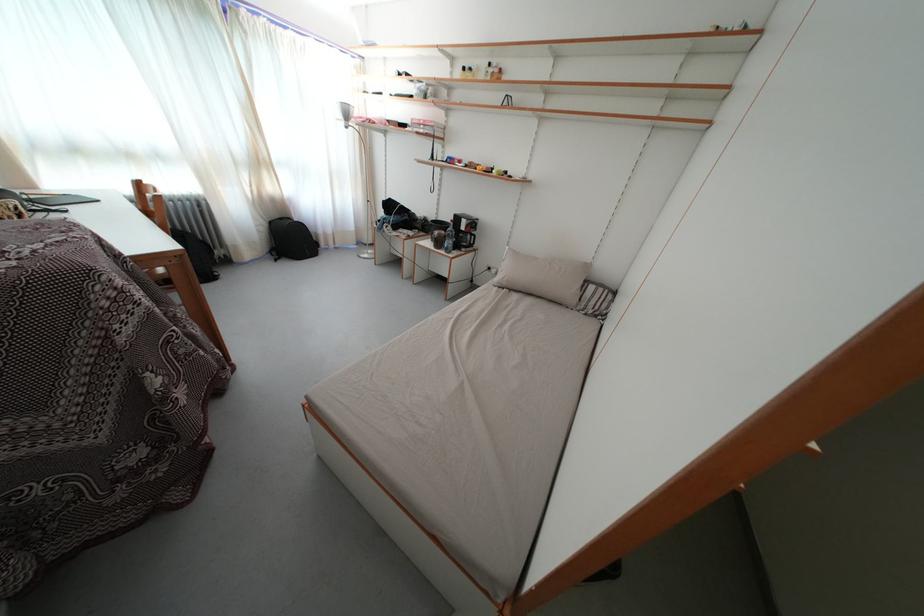
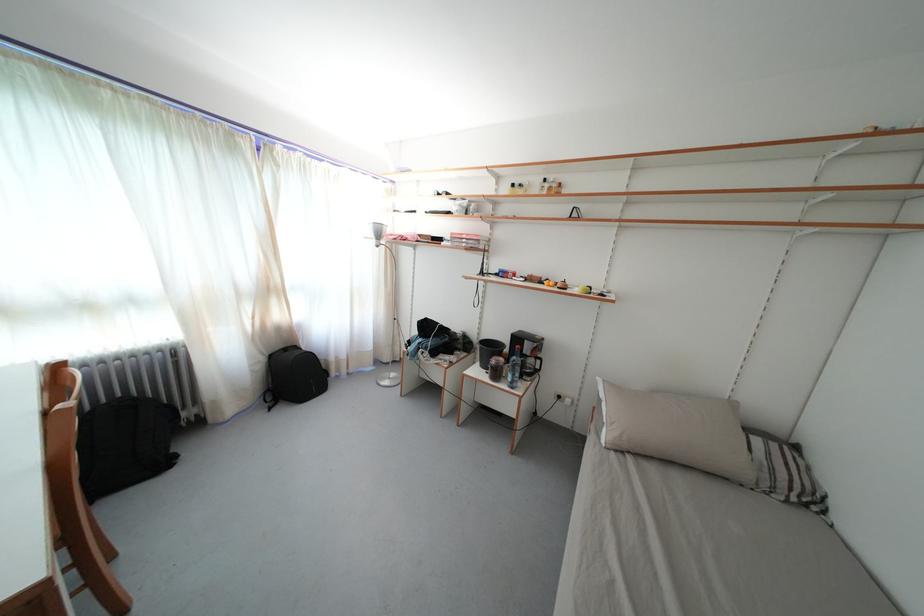
In the second image, find the point that corresponds to (x=346, y=121) in the first image.

(378, 241)